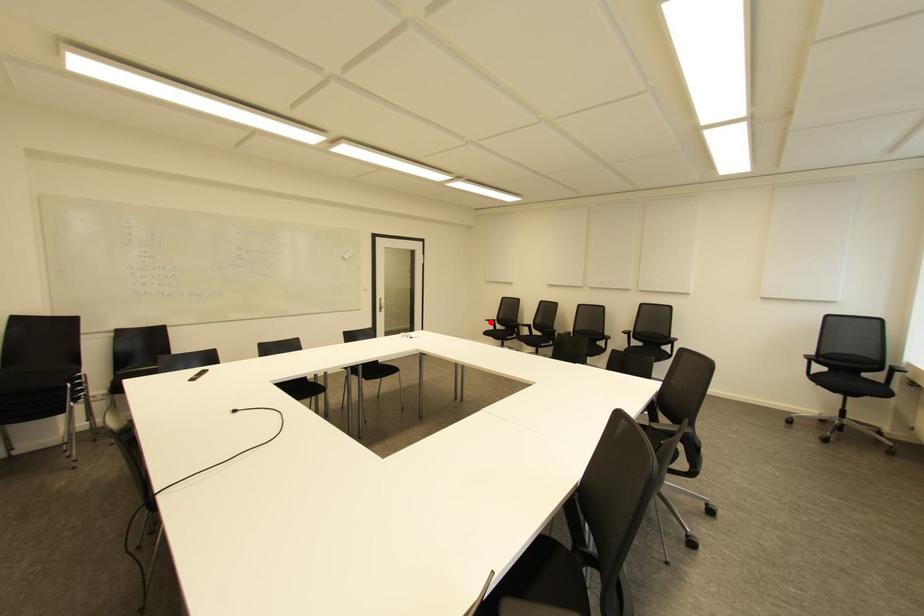
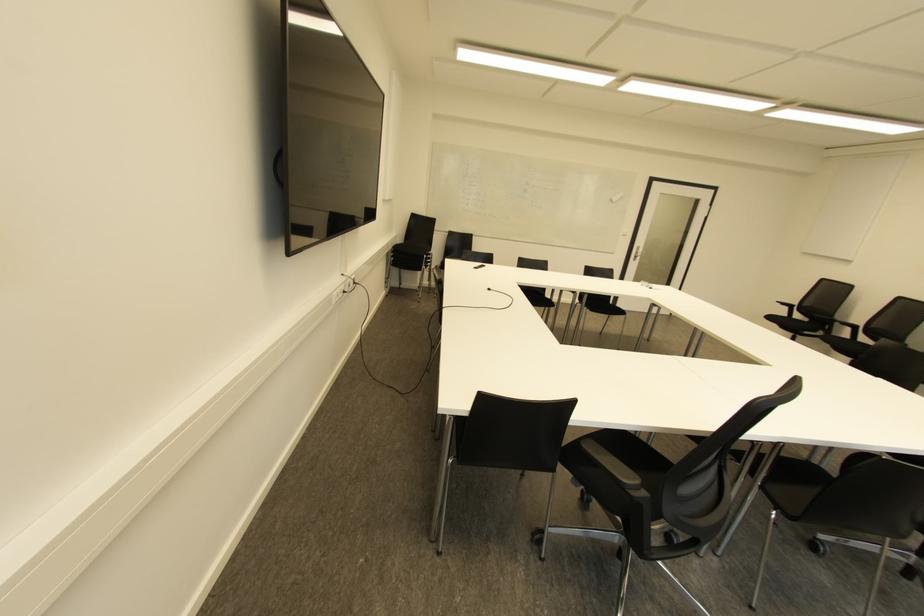
The point at the highlighted location is marked in the first image. Where is the corresponding point in the second image?

(785, 307)